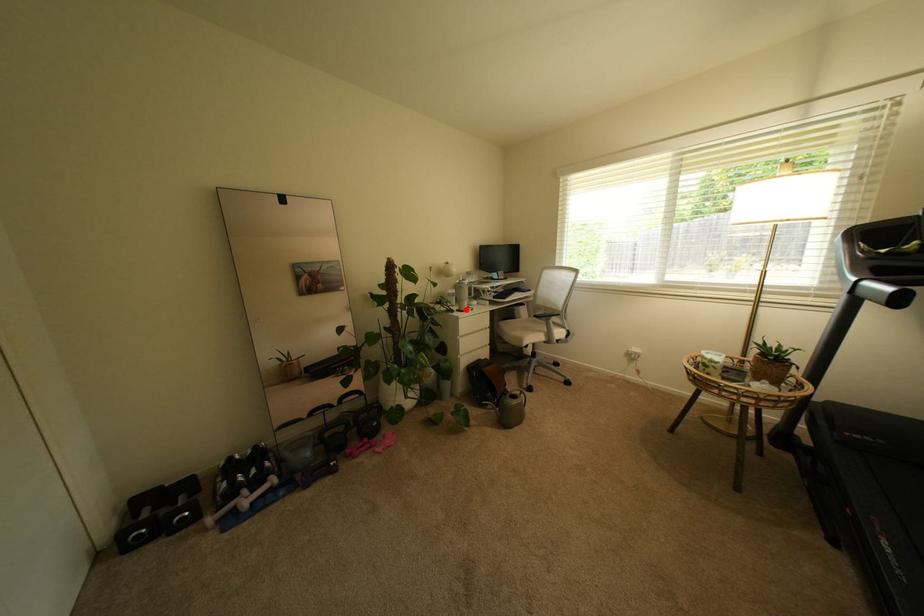
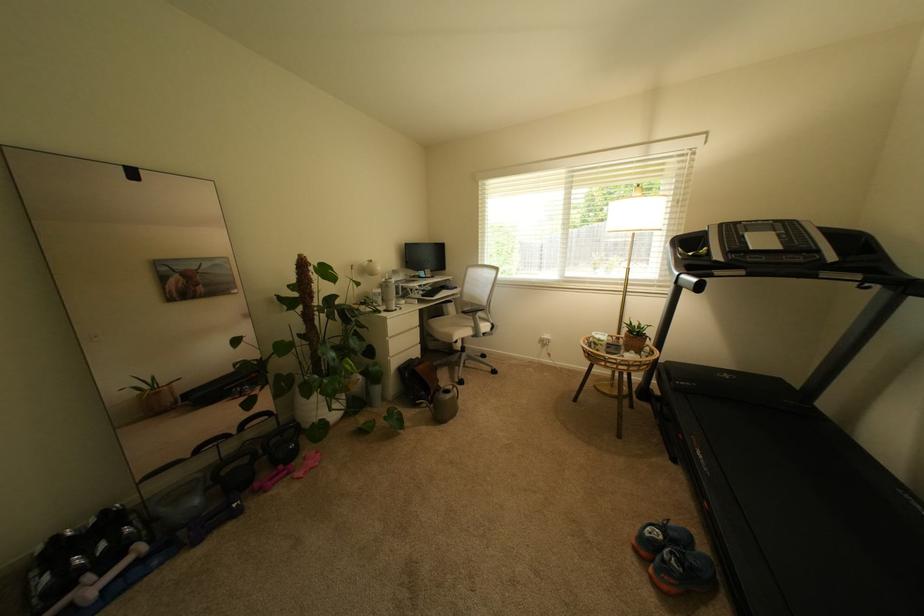
The point at the highlighted location is marked in the first image. Where is the corresponding point in the second image?

(393, 310)